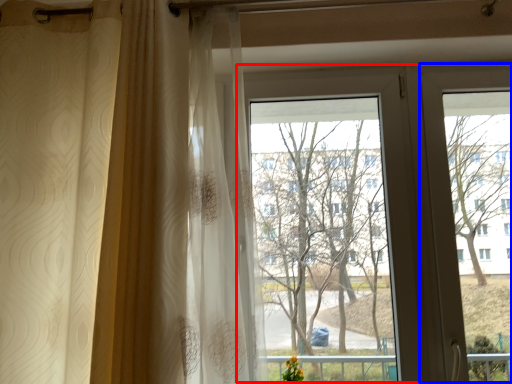
Question: Which object appears closest to the camera in this image, bay window (highlighted by a red box) or screen door (highlighted by a blue box)?

Choices:
 (A) bay window
 (B) screen door

Answer: (A)